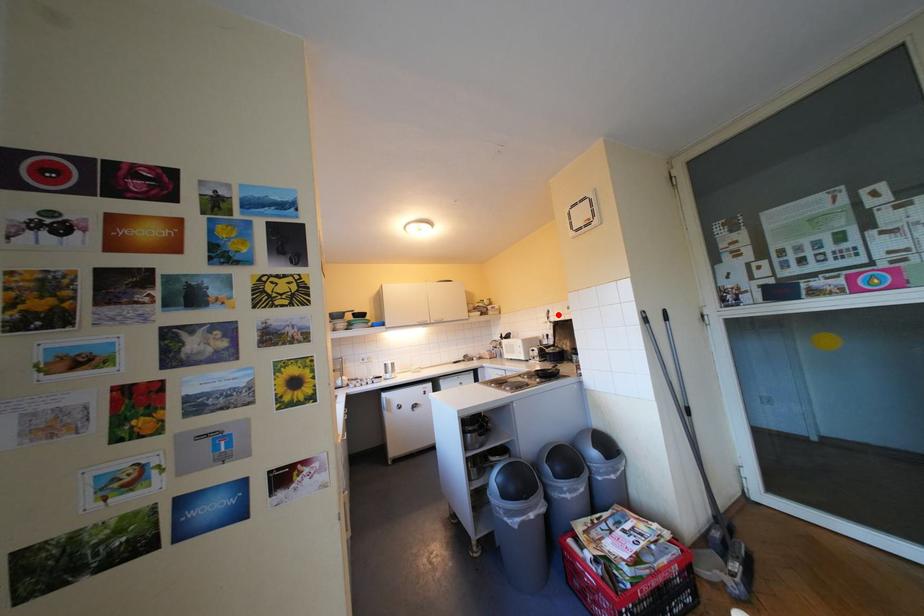
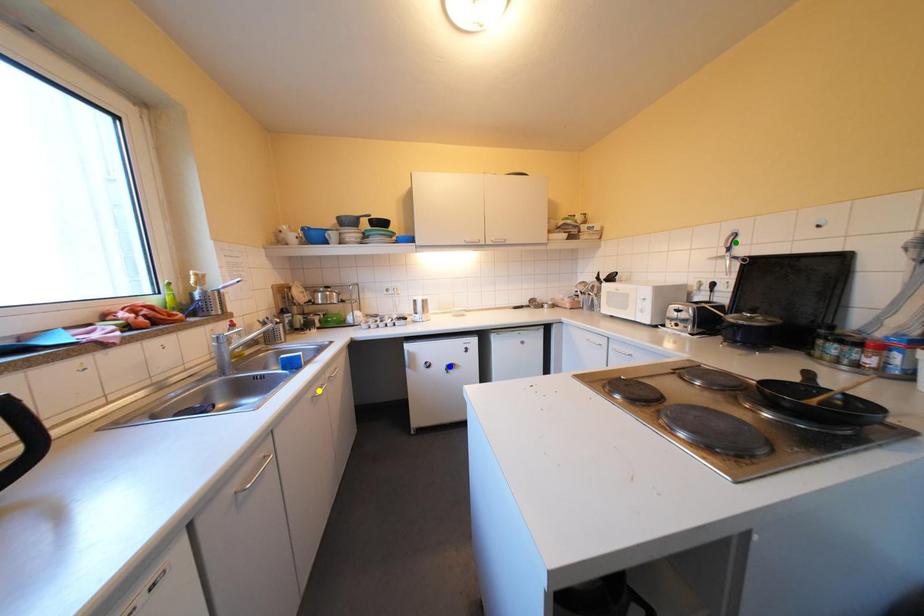
Question: I am providing you with two images of the same scene from different viewpoints. A red point is marked on the first image. You are given multiple points on the second image. Which mark in image 2 goes with the point in image 1?

Choices:
 (A) green point
 (B) yellow point
 (C) blue point

Answer: (A)